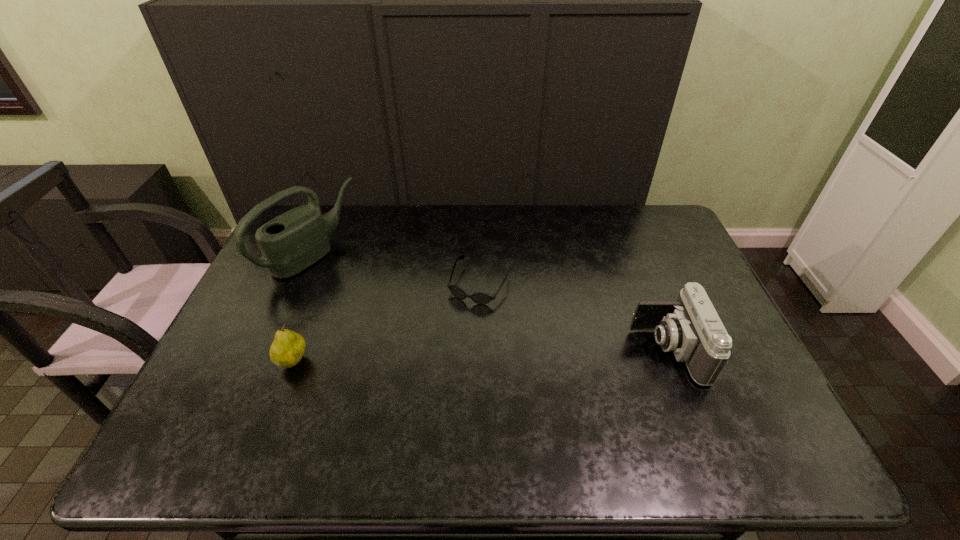
Locate an element on the screen. This screenshot has height=540, width=960. vacant space on the desktop that is between the pear and the rightmost object and is positioned on the spout of the tallest object is located at coordinates (484, 356).

This screenshot has height=540, width=960. What are the coordinates of `vacant space on the desktop that is between the third tallest object and the rightmost object and is positioned on the lenses of the third object from left to right` in the screenshot? It's located at (442, 357).